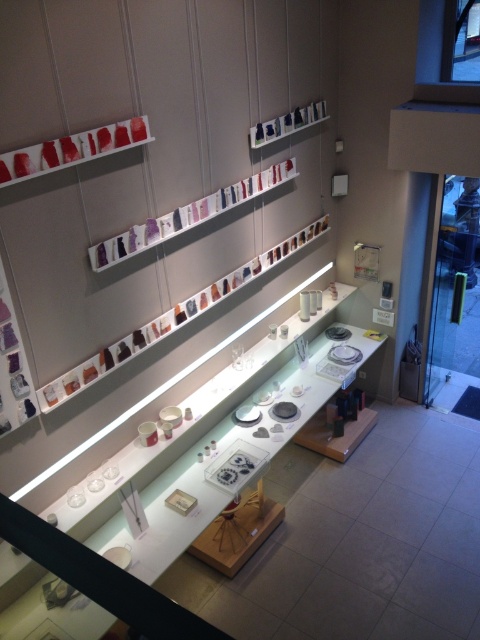
Does purple glassware at upper center lie behind matte red glassware at upper left?

Yes, it is.

Based on the photo, who is lower down, purple glassware at upper center or matte red glassware at upper left?

purple glassware at upper center

Is point (215, 208) farther from camera compared to point (66, 141)?

Yes.

Where is `purple glassware at upper center`? The image size is (480, 640). purple glassware at upper center is located at coordinates (187, 216).

Between matte glass jewelry at center and purple glassware at upper center, which one has less height?

purple glassware at upper center is shorter.

Is point (117, 268) behind point (211, 212)?

That is False.

This screenshot has height=640, width=480. What do you see at coordinates (151, 150) in the screenshot? I see `matte glass jewelry at center` at bounding box center [151, 150].

This screenshot has height=640, width=480. I want to click on matte glass jewelry at center, so tap(151, 150).

Does matte glass jewelry at center have a lesser height compared to matte red glassware at upper left?

No.

What do you see at coordinates (151, 150) in the screenshot?
I see `matte glass jewelry at center` at bounding box center [151, 150].

Describe the element at coordinates (151, 150) in the screenshot. This screenshot has height=640, width=480. I see `matte glass jewelry at center` at that location.

Identify the location of matte glass jewelry at center. Image resolution: width=480 pixels, height=640 pixels. (151, 150).